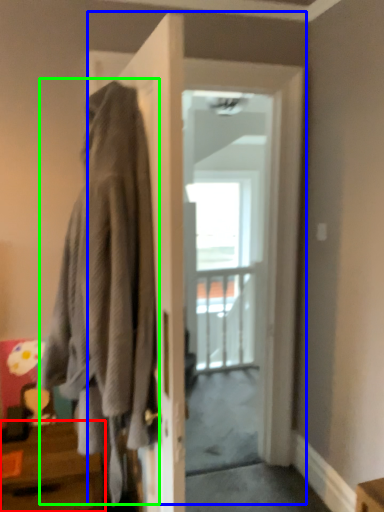
Question: Which object is the farthest from table (highlighted by a red box)? Choose among these: door (highlighted by a blue box) or laundry (highlighted by a green box).

Choices:
 (A) door
 (B) laundry

Answer: (A)